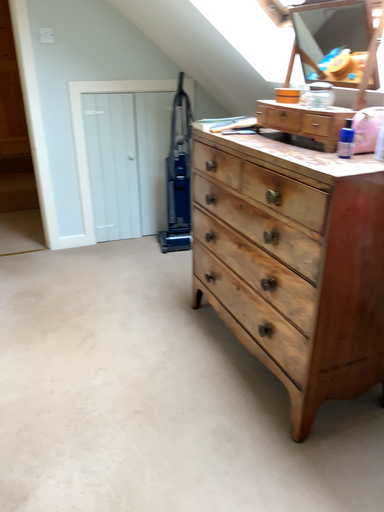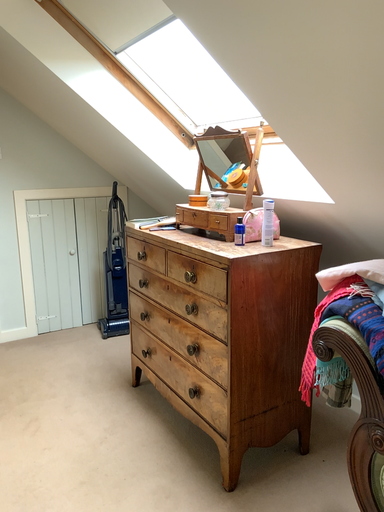
Question: How did the camera likely rotate when shooting the video?

Choices:
 (A) rotated left
 (B) rotated right

Answer: (B)